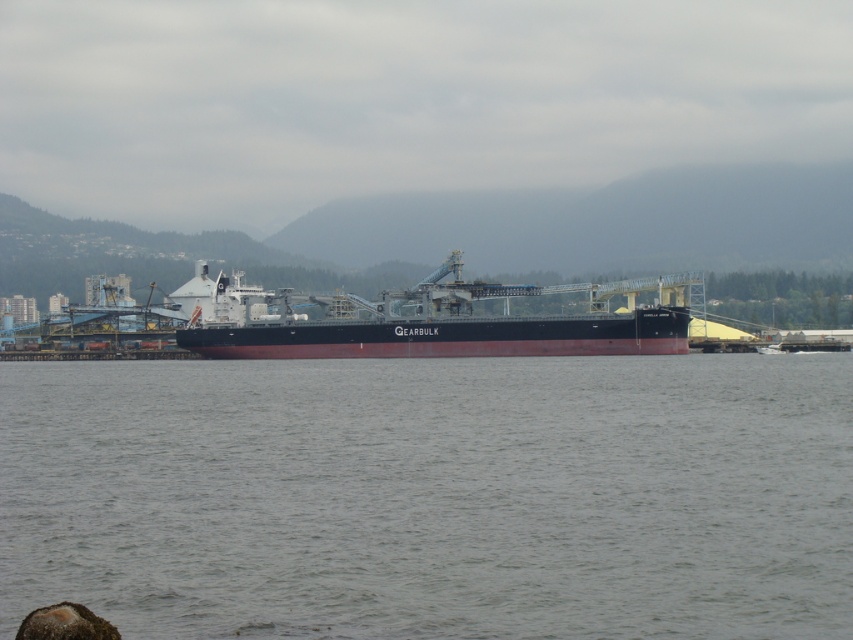
Can you confirm if gray water at center is positioned above black matte cargo ship at center?

Incorrect, gray water at center is not positioned above black matte cargo ship at center.

Find the location of a particular element. This screenshot has height=640, width=853. gray water at center is located at coordinates (432, 496).